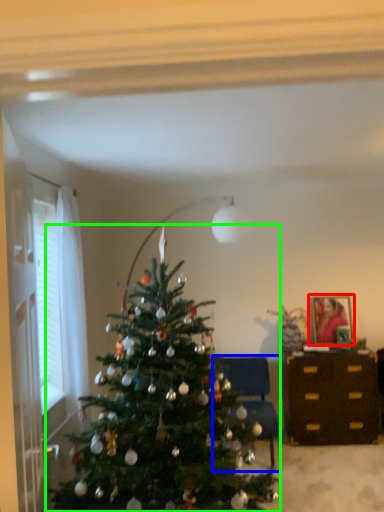
Question: Which object is the closest to the picture frame (highlighted by a red box)? Choose among these: furniture (highlighted by a blue box) or christmas tree (highlighted by a green box).

Choices:
 (A) furniture
 (B) christmas tree

Answer: (A)